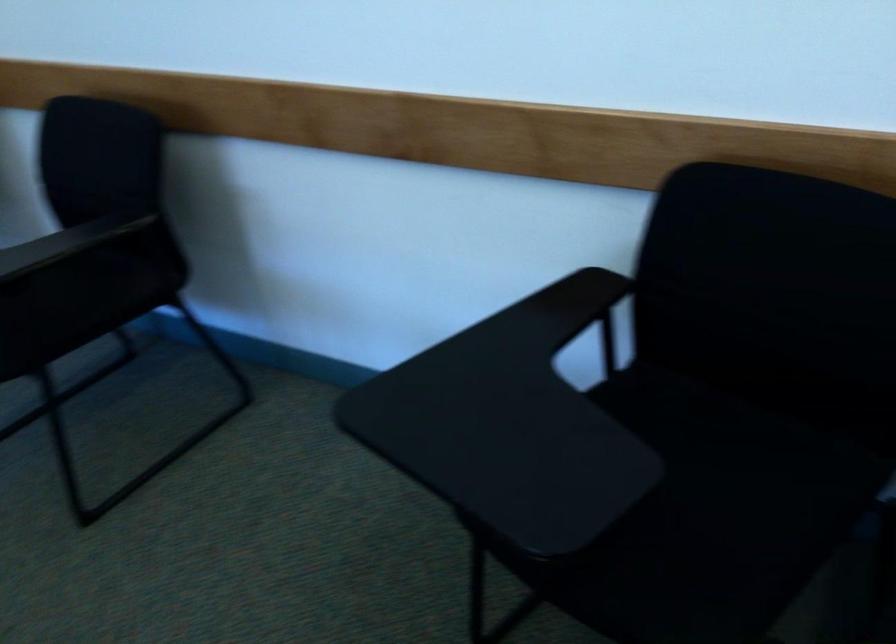
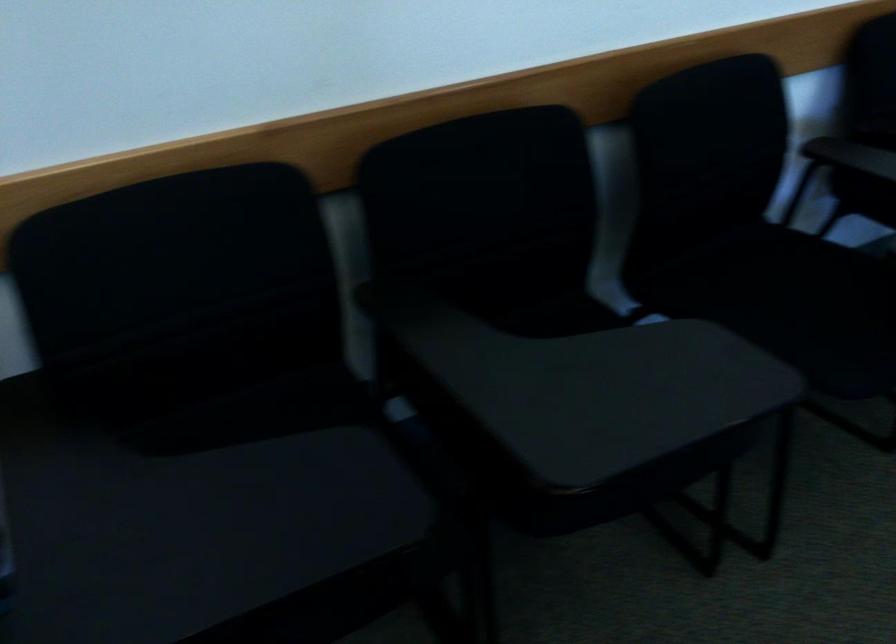
Question: The camera is either moving clockwise (left) or counter-clockwise (right) around the object. The first image is from the beginning of the video and the second image is from the end. Is the camera moving left or right when shooting the video?

Choices:
 (A) Left
 (B) Right

Answer: (A)